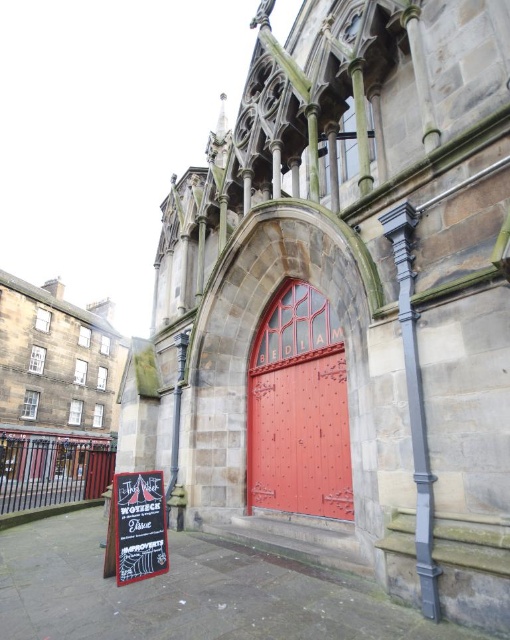
Which is above, smooth stone church at lower left or glossy metal door at center?

glossy metal door at center is above.

What do you see at coordinates (58, 374) in the screenshot? This screenshot has width=510, height=640. I see `smooth stone church at lower left` at bounding box center [58, 374].

This screenshot has width=510, height=640. Identify the location of smooth stone church at lower left. (58, 374).

Locate an element on the screen. The image size is (510, 640). smooth stone church at lower left is located at coordinates (58, 374).

Can you confirm if glossy metal door at center is taller than black chalkboard sign at lower left?

Yes, glossy metal door at center is taller than black chalkboard sign at lower left.

Is point (278, 460) less distant than point (140, 556)?

No, (278, 460) is further to viewer.

Is point (277, 440) positioned before point (114, 528)?

That is False.

Find the location of `glossy metal door at center`. glossy metal door at center is located at coordinates (299, 435).

Does point (38, 428) come closer to viewer compared to point (149, 483)?

That is False.

How far apart are smooth stone church at lower left and black chalkboard sign at lower left?

smooth stone church at lower left is 46.45 meters from black chalkboard sign at lower left.

Which is in front, point (39, 460) or point (150, 472)?

Positioned in front is point (150, 472).

This screenshot has height=640, width=510. What are the coordinates of `smooth stone church at lower left` in the screenshot? It's located at (58, 374).